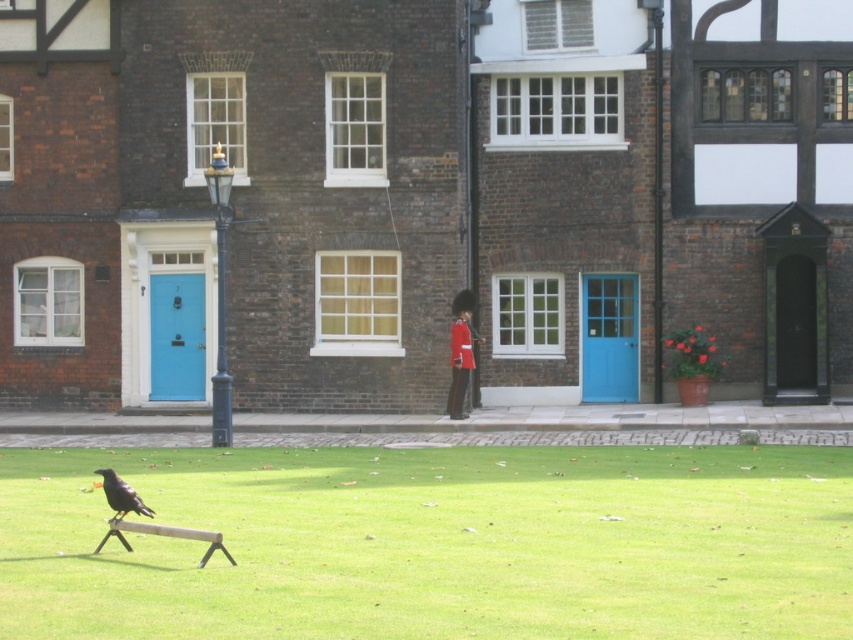
Between shiny red uniform at center and wooden park bench at lower center, which one is positioned higher?

shiny red uniform at center is above.

Who is taller, shiny red uniform at center or wooden park bench at lower center?

shiny red uniform at center

Which is behind, point (469, 376) or point (99, 544)?

Positioned behind is point (469, 376).

Image resolution: width=853 pixels, height=640 pixels. Identify the location of shiny red uniform at center. (461, 353).

Can you confirm if green grass at lower center is bigger than wooden park bench at lower center?

Indeed, green grass at lower center has a larger size compared to wooden park bench at lower center.

Who is more forward, (477, 492) or (173, 529)?

Positioned in front is point (173, 529).

I want to click on green grass at lower center, so click(434, 544).

Image resolution: width=853 pixels, height=640 pixels. What do you see at coordinates (434, 544) in the screenshot?
I see `green grass at lower center` at bounding box center [434, 544].

Who is positioned more to the right, green grass at lower center or shiny red uniform at center?

Positioned to the right is shiny red uniform at center.

Which is in front, point (764, 504) or point (465, 317)?

Point (764, 504)

Where is `green grass at lower center`? The height and width of the screenshot is (640, 853). green grass at lower center is located at coordinates (434, 544).